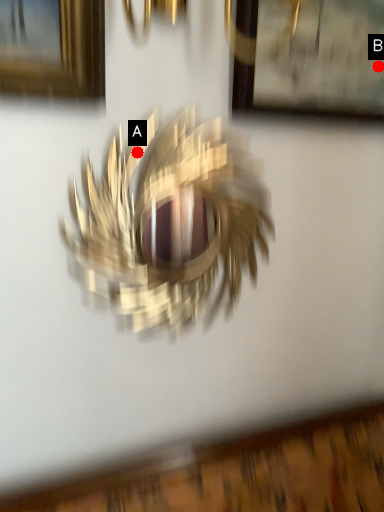
Question: Two points are circled on the image, labeled by A and B beside each circle. Which point is closer to the camera?

Choices:
 (A) A is closer
 (B) B is closer

Answer: (A)